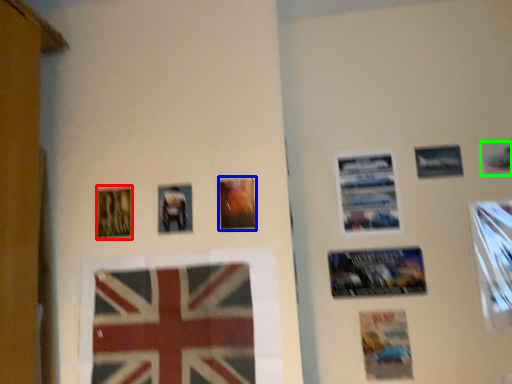
Question: Based on their relative distances, which object is farther from picture frame (highlighted by a red box)? Choose from picture frame (highlighted by a blue box) and picture frame (highlighted by a green box).

Choices:
 (A) picture frame
 (B) picture frame

Answer: (B)